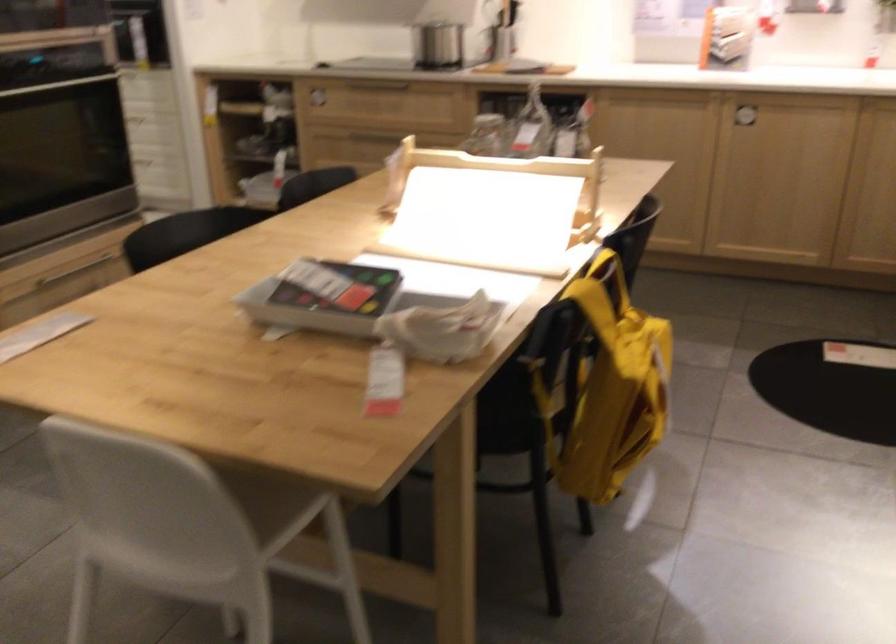
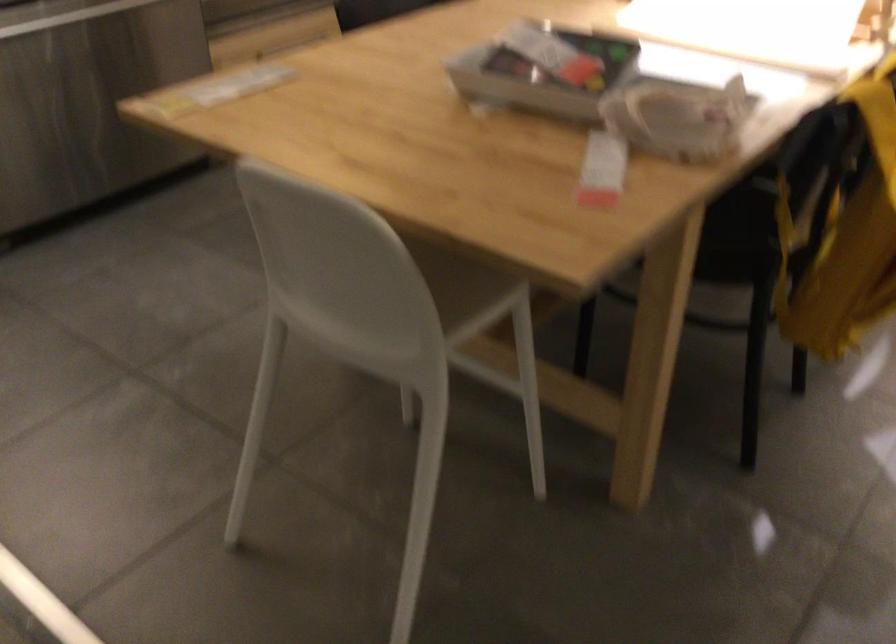
In the second image, find the point that corresponds to the point at 282,500 in the first image.

(468, 290)